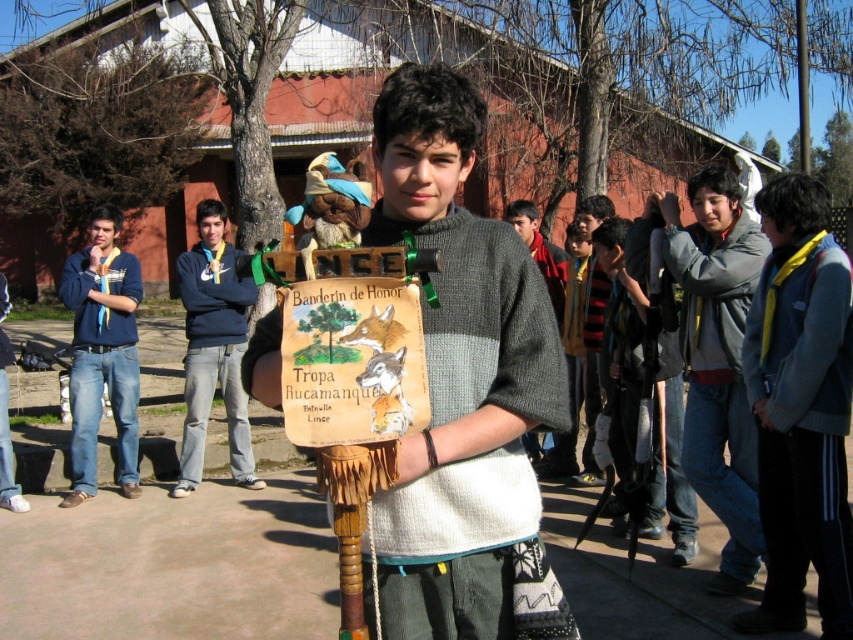
You are a photographer trying to capture a closeup of the blue sweatshirt at center. However, the yellow fabric scarf at right is blocking your view. Can you determine if the scarf is above or below the sweatshirt?

The yellow fabric scarf at right is below the blue sweatshirt at center, so it is blocking the lower part of the sweatshirt and not the main area you want to capture.

You are a photographer standing 10 feet away from the camera. You want to capture the yellow fabric scarf at right in your photo. Can you reach the scarf within your current distance?

The yellow fabric scarf at right and camera are 11.07 feet apart from each other. Since you are standing 10 feet away from the camera, you are 1 foot closer than the distance required to reach the scarf. Therefore, you cannot capture the scarf within your current distance.

You are a photographer trying to capture a group photo of the scouts. You notice two central figures wearing a knitted sweater at center and a blue sweatshirt at center. Which of these two items of clothing is shorter in height?

The knitted sweater at center is not as tall as the blue sweatshirt at center, so the knitted sweater at center is shorter in height.